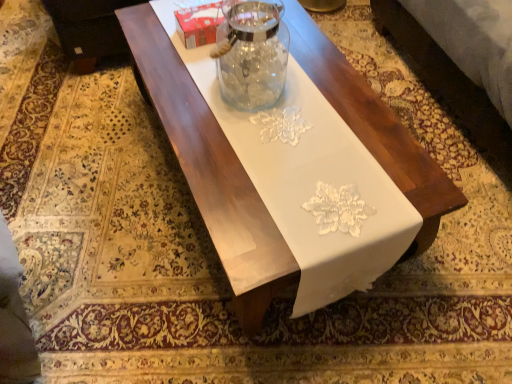
In order to face transparent glass jar at center, should I rotate leftwards or rightwards?

It's best to rotate left around 0.992 degrees.

The width and height of the screenshot is (512, 384). Identify the location of white glossy table at center. (210, 169).

Identify the location of transparent glass jar at center. The height and width of the screenshot is (384, 512). (251, 53).

Can you confirm if white glossy table at center is positioned to the left of black leather couch at upper left?

In fact, white glossy table at center is to the right of black leather couch at upper left.

Based on the photo, relative to black leather couch at upper left, is white glossy table at center in front or behind?

In the image, white glossy table at center appears in front of black leather couch at upper left.

Does point (234, 261) lie behind point (70, 36)?

No, it is in front of (70, 36).

From the image's perspective, would you say white glossy table at center is positioned over black leather couch at upper left?

No.

Considering the sizes of black leather couch at upper left and transparent glass jar at center in the image, is black leather couch at upper left wider or thinner than transparent glass jar at center?

Considering their sizes, black leather couch at upper left looks broader than transparent glass jar at center.

Considering the sizes of objects black leather couch at upper left and transparent glass jar at center in the image provided, who is smaller, black leather couch at upper left or transparent glass jar at center?

transparent glass jar at center is smaller.

Which is more to the right, black leather couch at upper left or transparent glass jar at center?

transparent glass jar at center is more to the right.

Is black leather couch at upper left smaller than white glossy table at center?

Indeed, black leather couch at upper left has a smaller size compared to white glossy table at center.

At what (x,y) coordinates should I click in order to perform the action: click on couch above the white glossy table at center (from the image's perspective). Please return your answer as a coordinate pair (x, y). Looking at the image, I should click on (89, 29).

Is black leather couch at upper left at the left side of white glossy table at center?

Correct, you'll find black leather couch at upper left to the left of white glossy table at center.

Is black leather couch at upper left closer to the viewer compared to white glossy table at center?

No.

Which is closer, [234,82] or [74,2]?

Point [234,82] is positioned closer to the camera compared to point [74,2].

How different are the orientations of transparent glass jar at center and black leather couch at upper left in degrees?

The facing directions of transparent glass jar at center and black leather couch at upper left are 94.2 degrees apart.

Considering the relative positions of transparent glass jar at center and black leather couch at upper left in the image provided, is transparent glass jar at center behind black leather couch at upper left?

That is False.

Would you say white glossy table at center is a long distance from transparent glass jar at center?

No, white glossy table at center is not far away from transparent glass jar at center.

From the image's perspective, is white glossy table at center on transparent glass jar at center?

Actually, white glossy table at center appears below transparent glass jar at center in the image.

From the picture: Can you confirm if white glossy table at center is taller than transparent glass jar at center?

Indeed, white glossy table at center has a greater height compared to transparent glass jar at center.

Is white glossy table at center positioned with its back to transparent glass jar at center?

No, transparent glass jar at center is not at the back of white glossy table at center.

Does transparent glass jar at center have a greater height compared to white glossy table at center?

No.

Between point (254, 89) and point (220, 166), which one is positioned in front?

The point (220, 166) is closer to the camera.

In the image, there is a transparent glass jar at center. At what (x,y) coordinates should I click in order to perform the action: click on table below it (from the image's perspective). Please return your answer as a coordinate pair (x, y). Image resolution: width=512 pixels, height=384 pixels. Looking at the image, I should click on (210, 169).

Is transparent glass jar at center far from white glossy table at center?

transparent glass jar at center is near white glossy table at center, not far away.

Where is `couch located above the white glossy table at center (from the image's perspective)`? The image size is (512, 384). couch located above the white glossy table at center (from the image's perspective) is located at coordinates (89, 29).

The width and height of the screenshot is (512, 384). Find the location of `glass vase that appears in front of the black leather couch at upper left`. glass vase that appears in front of the black leather couch at upper left is located at coordinates (251, 53).

When comparing their distances from white glossy table at center, does transparent glass jar at center or black leather couch at upper left seem further?

black leather couch at upper left.

Based on the photo, when comparing their distances from black leather couch at upper left, does white glossy table at center or transparent glass jar at center seem further?

The object further to black leather couch at upper left is transparent glass jar at center.

Based on their spatial positions, is black leather couch at upper left or white glossy table at center closer to transparent glass jar at center?

white glossy table at center is closer to transparent glass jar at center.

From the image, which object appears to be nearer to black leather couch at upper left, transparent glass jar at center or white glossy table at center?

The object closer to black leather couch at upper left is white glossy table at center.

Which object lies further to the anchor point transparent glass jar at center, white glossy table at center or black leather couch at upper left?

black leather couch at upper left.

Looking at the image, which one is located further to white glossy table at center, black leather couch at upper left or transparent glass jar at center?

black leather couch at upper left is further to white glossy table at center.

The height and width of the screenshot is (384, 512). Find the location of `glass vase between black leather couch at upper left and white glossy table at center from left to right`. glass vase between black leather couch at upper left and white glossy table at center from left to right is located at coordinates (251, 53).